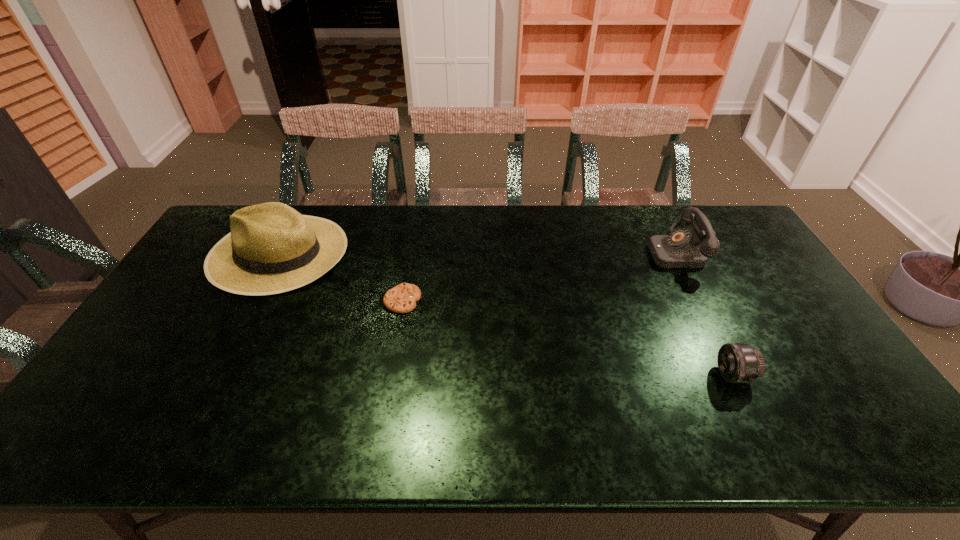
Identify the location of free space between the telephone and the third object from right to left. This screenshot has height=540, width=960. (539, 276).

Where is `vacant area between the telephoto lens and the leftmost object`? This screenshot has height=540, width=960. vacant area between the telephoto lens and the leftmost object is located at coordinates (506, 313).

What are the coordinates of `free space between the cookie and the second shortest object` in the screenshot? It's located at (567, 338).

Locate which object is the second closest to the telephone. Please provide its 2D coordinates. Your answer should be formatted as a tuple, i.e. [(x, y)], where the tuple contains the x and y coordinates of a point satisfying the conditions above.

[(402, 298)]

Locate which object ranks third in proximity to the nearest object. Please provide its 2D coordinates. Your answer should be formatted as a tuple, i.e. [(x, y)], where the tuple contains the x and y coordinates of a point satisfying the conditions above.

[(272, 248)]